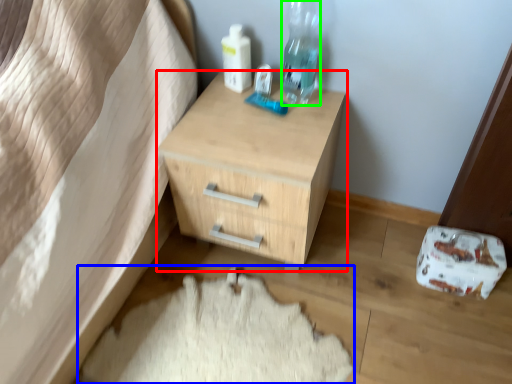
Question: Estimate the real-world distances between objects in this image. Which object is farther from chest of drawers (highlighted by a red box), sheet (highlighted by a blue box) or bottle (highlighted by a green box)?

Choices:
 (A) sheet
 (B) bottle

Answer: (A)